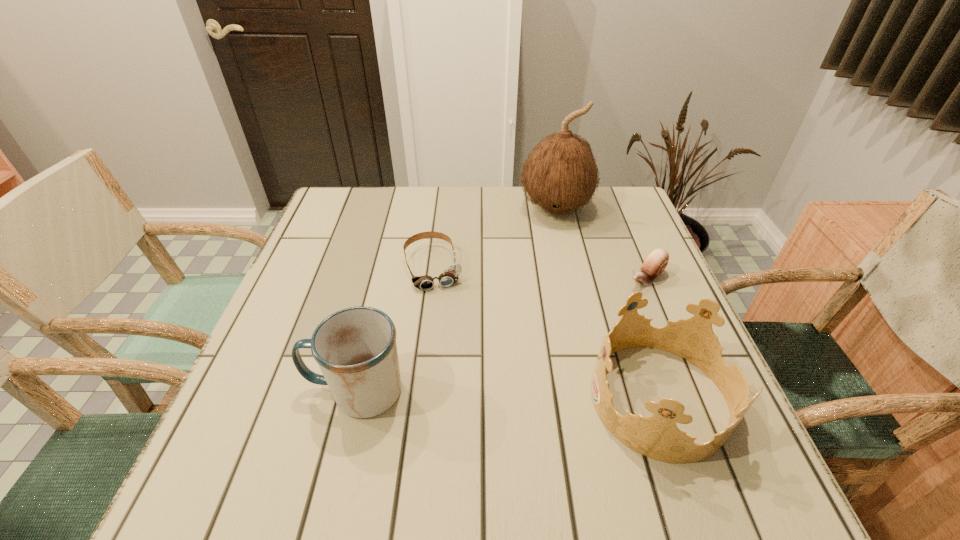
This screenshot has height=540, width=960. I want to click on mug, so click(356, 350).

Locate an element on the screen. This screenshot has width=960, height=540. tiara is located at coordinates (658, 437).

Image resolution: width=960 pixels, height=540 pixels. In order to click on goggles in this screenshot , I will do `click(450, 275)`.

Where is `coconut`? coconut is located at coordinates click(560, 175).

This screenshot has width=960, height=540. I want to click on the tallest object, so click(x=560, y=175).

Locate an element on the screen. The image size is (960, 540). the second shortest object is located at coordinates (656, 261).

Locate an element on the screen. The width and height of the screenshot is (960, 540). blank space located 0.090m on the handle side of the mug is located at coordinates (257, 392).

Locate an element on the screen. Image resolution: width=960 pixels, height=540 pixels. vacant area situated on the handle side of the mug is located at coordinates (242, 392).

You are a GUI agent. You are given a task and a screenshot of the screen. Output one action in this format:
    pyautogui.click(x=<x>, y=<y>)
    Task: Click on the free space located 0.150m on the front-facing side of the tiara
    Image resolution: width=960 pixels, height=540 pixels.
    Given the screenshot: What is the action you would take?
    pyautogui.click(x=512, y=399)

You are a GUI agent. You are given a task and a screenshot of the screen. Output one action in this format:
    pyautogui.click(x=<x>, y=<y>)
    Task: Click on the vacant space located 0.150m on the front-facing side of the tiara
    Image resolution: width=960 pixels, height=540 pixels.
    Given the screenshot: What is the action you would take?
    pyautogui.click(x=512, y=399)